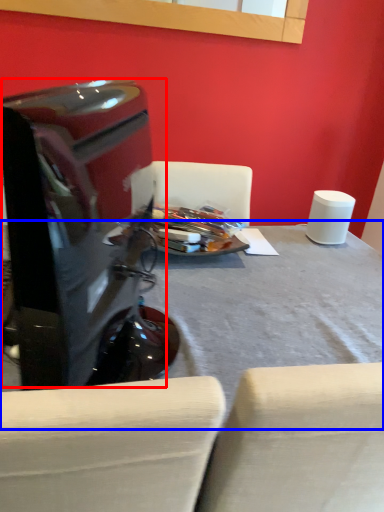
Question: Which object appears closest to the camera in this image, computer monitor (highlighted by a red box) or table (highlighted by a blue box)?

Choices:
 (A) computer monitor
 (B) table

Answer: (A)